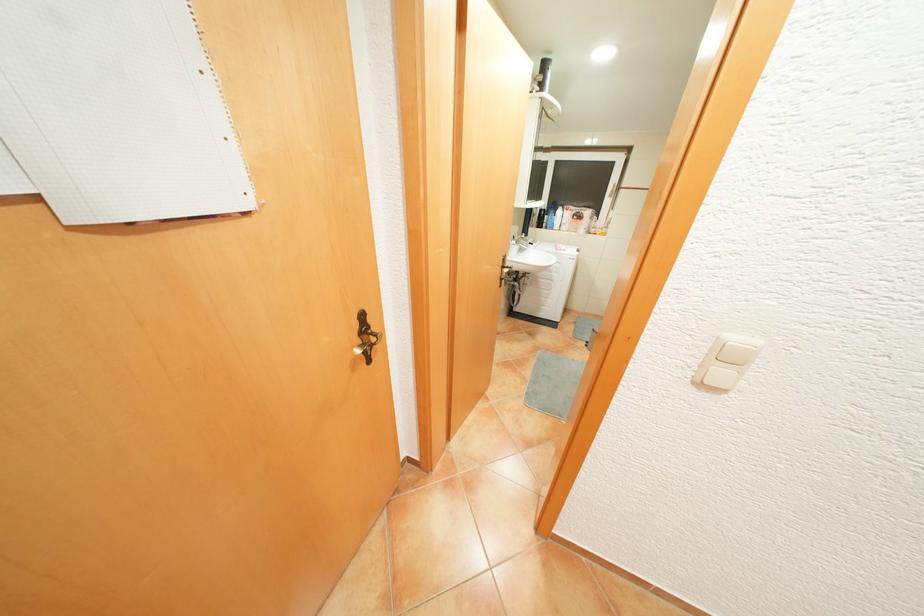
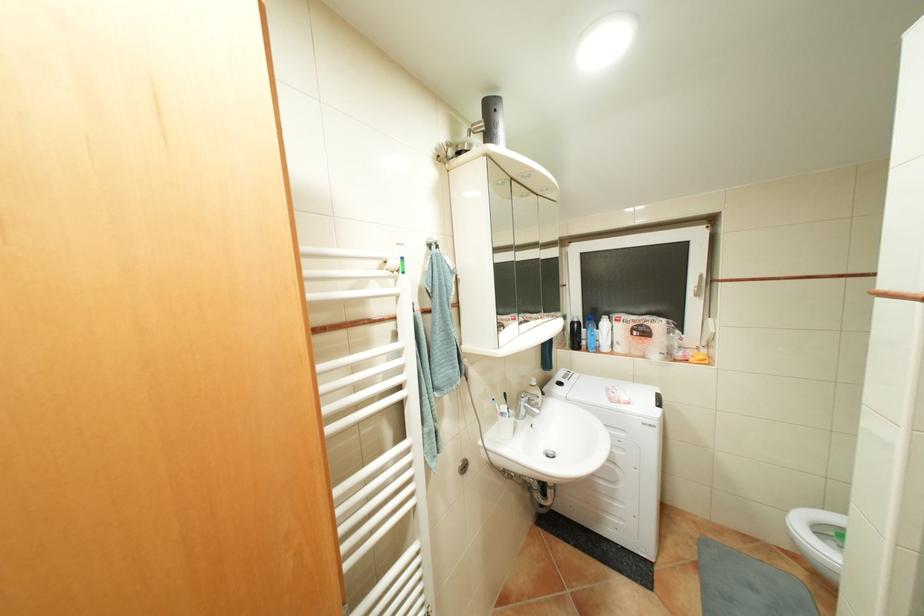
Where in the second image is the point corresponding to (x=554, y=65) from the first image?

(499, 108)